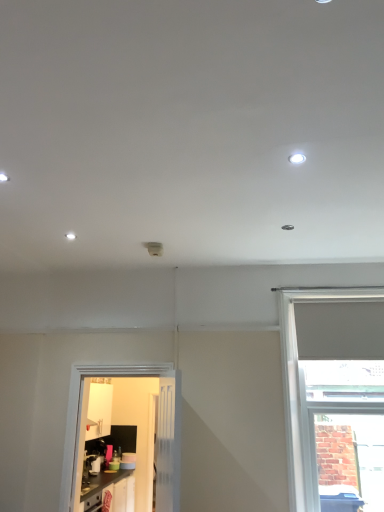
Question: Is matte black cabinets at lower left at the right side of white glossy door at lower left?

Choices:
 (A) yes
 (B) no

Answer: (B)

Question: Is matte black cabinets at lower left beside white glossy door at lower left?

Choices:
 (A) yes
 (B) no

Answer: (B)

Question: Could you tell me if matte black cabinets at lower left is turned towards white glossy door at lower left?

Choices:
 (A) no
 (B) yes

Answer: (A)

Question: Is matte black cabinets at lower left wider than white glossy door at lower left?

Choices:
 (A) yes
 (B) no

Answer: (A)

Question: Does matte black cabinets at lower left have a smaller size compared to white glossy door at lower left?

Choices:
 (A) yes
 (B) no

Answer: (B)

Question: From their relative heights in the image, would you say white matte window at right is taller or shorter than white glossy light fixture at upper right?

Choices:
 (A) short
 (B) tall

Answer: (B)

Question: Would you say white matte window at right is inside or outside white glossy light fixture at upper right?

Choices:
 (A) outside
 (B) inside

Answer: (A)

Question: From a real-world perspective, is white matte window at right positioned above or below white glossy light fixture at upper right?

Choices:
 (A) below
 (B) above

Answer: (A)

Question: Based on their positions, is white matte window at right located to the left or right of white glossy light fixture at upper right?

Choices:
 (A) left
 (B) right

Answer: (B)

Question: Considering the positions of white glossy door at lower left and white matte window at right in the image, is white glossy door at lower left taller or shorter than white matte window at right?

Choices:
 (A) tall
 (B) short

Answer: (B)

Question: Is white glossy door at lower left wider or thinner than white matte window at right?

Choices:
 (A) wide
 (B) thin

Answer: (B)

Question: Is white glossy door at lower left inside the boundaries of white matte window at right, or outside?

Choices:
 (A) inside
 (B) outside

Answer: (B)

Question: Based on their positions, is white glossy door at lower left located to the left or right of white matte window at right?

Choices:
 (A) left
 (B) right

Answer: (A)

Question: In terms of height, does white matte window at right look taller or shorter compared to white glossy door at lower left?

Choices:
 (A) tall
 (B) short

Answer: (A)

Question: Is point (286, 398) closer or farther from the camera than point (165, 507)?

Choices:
 (A) farther
 (B) closer

Answer: (A)